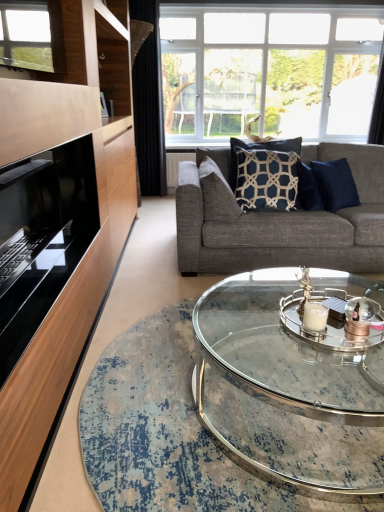
Question: From their relative heights in the image, would you say clear glass coffee table at center is taller or shorter than black fabric curtain at left, which ranks as the first curtain in left-to-right order?

Choices:
 (A) short
 (B) tall

Answer: (A)

Question: Is clear glass coffee table at center bigger or smaller than black fabric curtain at left, which ranks as the first curtain in left-to-right order?

Choices:
 (A) small
 (B) big

Answer: (B)

Question: Which of these objects is positioned farthest from the black fabric curtain at left, which ranks as the first curtain in left-to-right order?

Choices:
 (A) blue textured pillow at center, which is counted as the 2th pillow, starting from the right
 (B) clear glass candle holder at center
 (C) clear glass coffee table at center
 (D) navy blue fabric pillow at center, the first pillow viewed from the right
 (E) black glass fireplace at left

Answer: (B)

Question: Which of these objects is positioned farthest from the clear glass candle holder at center?

Choices:
 (A) clear glass window at upper center
 (B) blue textured pillow at center, which is counted as the 2th pillow, starting from the right
 (C) navy blue fabric pillow at center, the 2th pillow in the left-to-right sequence
 (D) textured gray couch at center
 (E) black glass fireplace at left

Answer: (A)